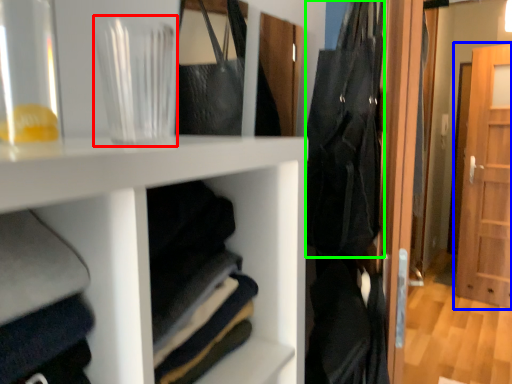
Question: Based on their relative distances, which object is farther from glass vase (highlighted by a red box)? Choose from door (highlighted by a blue box) and clothing (highlighted by a green box).

Choices:
 (A) door
 (B) clothing

Answer: (A)